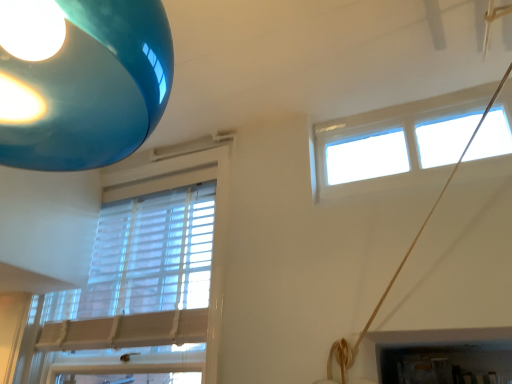
Question: Relative to white plastic window at upper right, the first window in the right-to-left sequence, is white textured blinds at left, arranged as the second window when viewed from the right, in front or behind?

Choices:
 (A) front
 (B) behind

Answer: (B)

Question: From the image's perspective, is white textured blinds at left, arranged as the second window when viewed from the right, located above or below white plastic window at upper right, marked as the second window in a left-to-right arrangement?

Choices:
 (A) above
 (B) below

Answer: (B)

Question: Is white textured blinds at left, the 1th window from the left, bigger or smaller than white plastic window at upper right, the first window in the right-to-left sequence?

Choices:
 (A) small
 (B) big

Answer: (B)

Question: In the image, is white plastic window at upper right, marked as the second window in a left-to-right arrangement, positioned in front of or behind white textured blinds at left, the 1th window from the left?

Choices:
 (A) front
 (B) behind

Answer: (A)

Question: Considering the positions of point (435, 182) and point (196, 152), is point (435, 182) closer or farther from the camera than point (196, 152)?

Choices:
 (A) farther
 (B) closer

Answer: (B)

Question: From the image's perspective, is white plastic window at upper right, the first window in the right-to-left sequence, above or below white textured blinds at left, arranged as the second window when viewed from the right?

Choices:
 (A) above
 (B) below

Answer: (A)

Question: Is white plastic window at upper right, marked as the second window in a left-to-right arrangement, bigger or smaller than white textured blinds at left, the 1th window from the left?

Choices:
 (A) big
 (B) small

Answer: (B)